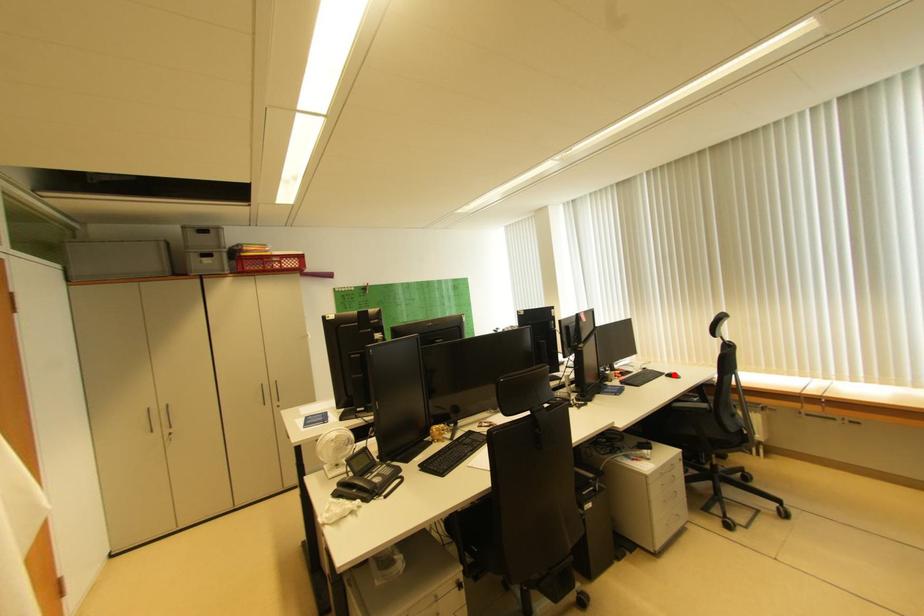
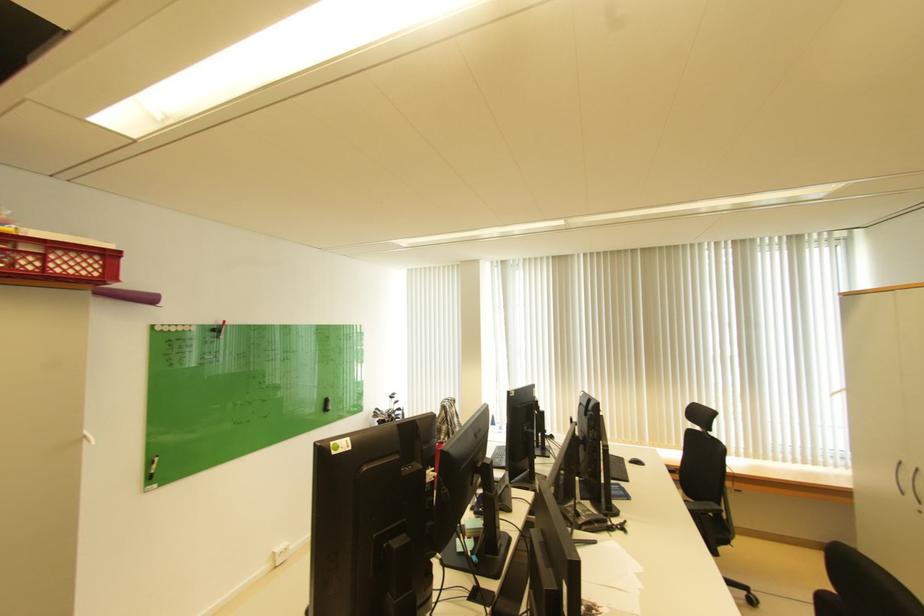
Question: I am providing you with two images of the same scene from different viewpoints. A red point is marked on the first image. Is the red point's position out of view in image 2?

Choices:
 (A) Yes
 (B) No

Answer: (B)